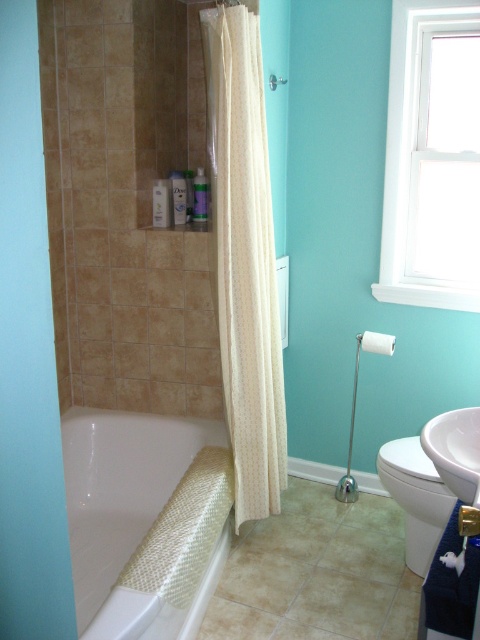
Question: Which of these objects is positioned farthest from the white glossy sink at lower right?

Choices:
 (A) white woven mat at lower left
 (B) white matte towel bar at upper right
 (C) white glossy toilet bowl at lower right

Answer: (A)

Question: Is white woven mat at lower left wider than white glossy toilet bowl at lower right?

Choices:
 (A) yes
 (B) no

Answer: (A)

Question: Estimate the real-world distances between objects in this image. Which object is farther from the white glass window at upper right?

Choices:
 (A) white matte towel bar at upper right
 (B) white glossy sink at lower right

Answer: (B)

Question: Which object is farther from the camera taking this photo?

Choices:
 (A) white glossy toilet bowl at lower right
 (B) white matte towel bar at upper right

Answer: (B)

Question: Is white woven mat at lower left bigger than white glossy sink at lower right?

Choices:
 (A) no
 (B) yes

Answer: (B)

Question: In this image, where is white woven mat at lower left located relative to white matte towel bar at upper right?

Choices:
 (A) below
 (B) above

Answer: (A)